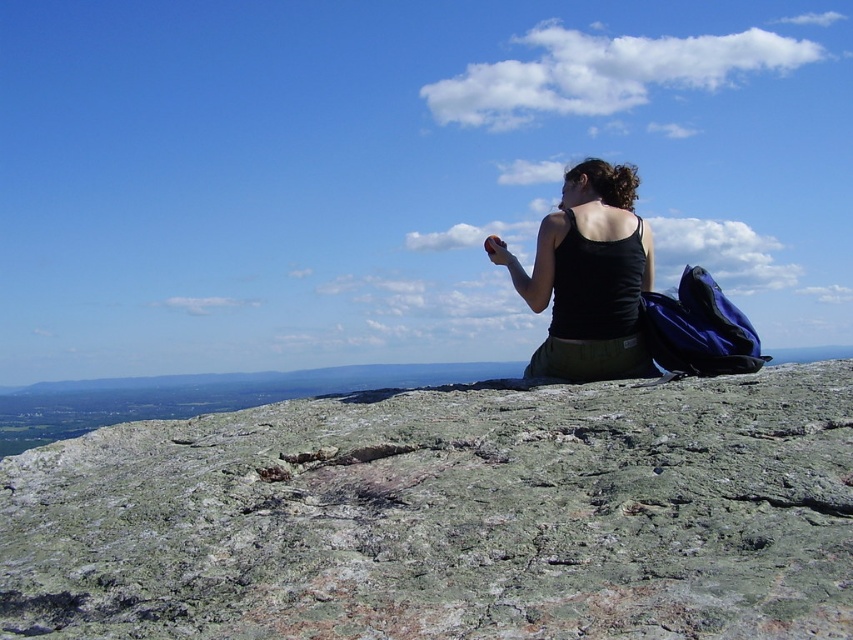
Question: Is green rough rock at center to the left of black tank top at center from the viewer's perspective?

Choices:
 (A) yes
 (B) no

Answer: (A)

Question: Can you confirm if green rough rock at center is thinner than black tank top at center?

Choices:
 (A) yes
 (B) no

Answer: (B)

Question: Is green rough rock at center positioned behind black tank top at center?

Choices:
 (A) no
 (B) yes

Answer: (A)

Question: Which point appears farthest from the camera in this image?

Choices:
 (A) 554,310
 (B) 805,612

Answer: (A)